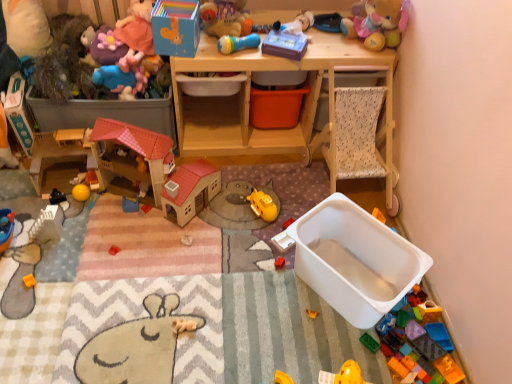
Image resolution: width=512 pixels, height=384 pixels. Identify the location of free area behind yellow matte submarine at center, marked as the 9th toy in a left-to-right arrangement. (266, 182).